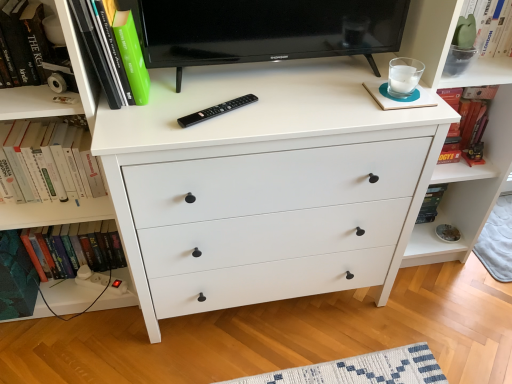
Where is `vacant position to the left of black plastic remote at center`? This screenshot has height=384, width=512. vacant position to the left of black plastic remote at center is located at coordinates (154, 115).